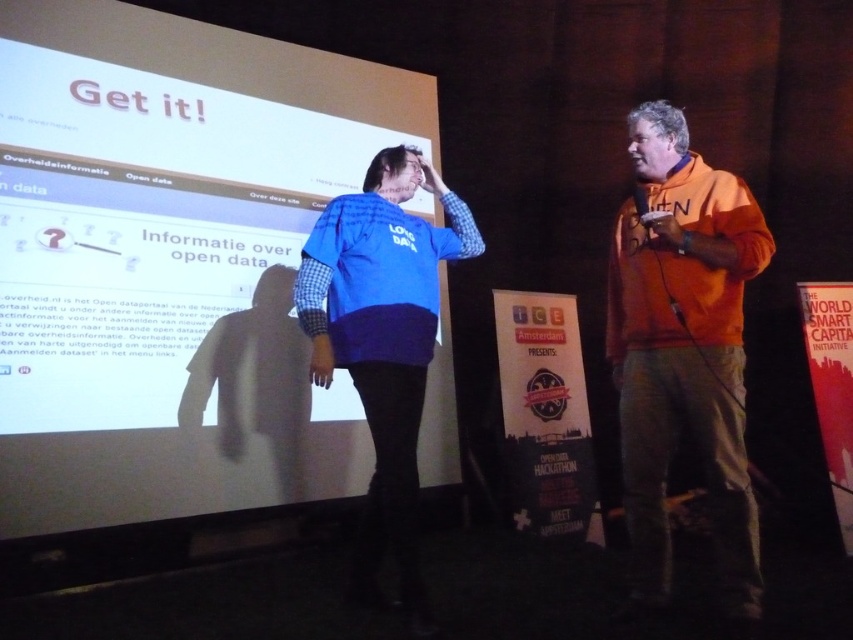
You are an event organizer who needs to place a 3D model of a city that is 1.2 meters wide on the stage. The model must be placed between the white matte projection screen at upper center and the orange fleece jacket at right. Can the space between them accommodate the model?

The white matte projection screen at upper center is wider than the orange fleece jacket at right. However, the exact distance between them isn not specified in the description. Without knowing the actual spacing, it is impossible to determine if the 1.2 meter wide model will fit.